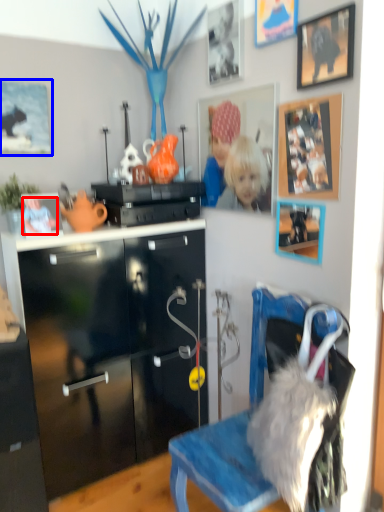
Question: Which object is closer to the camera taking this photo, person (highlighted by a red box) or picture frame (highlighted by a blue box)?

Choices:
 (A) person
 (B) picture frame

Answer: (A)